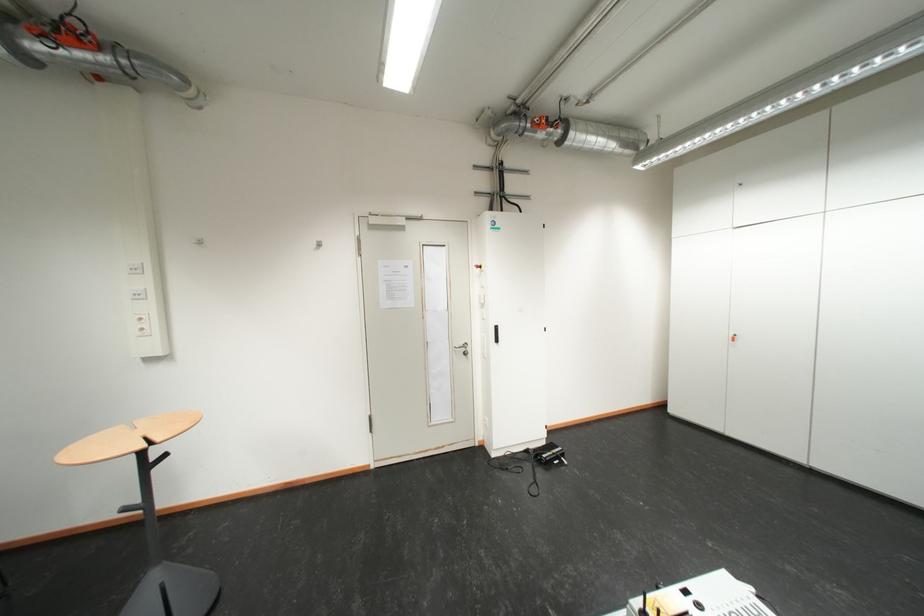
Describe the element at coordinates (539, 122) in the screenshot. This screenshot has height=616, width=924. I see `the red push button` at that location.